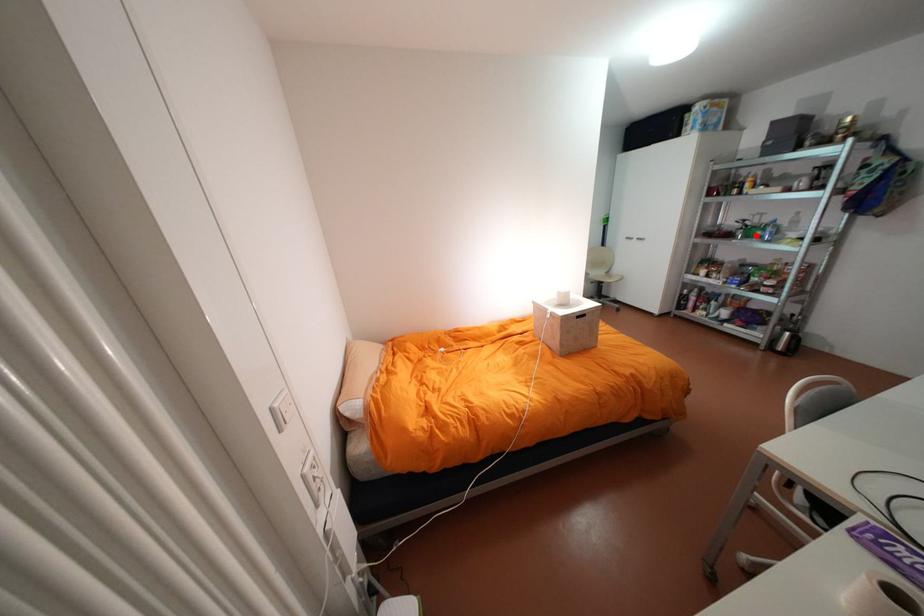
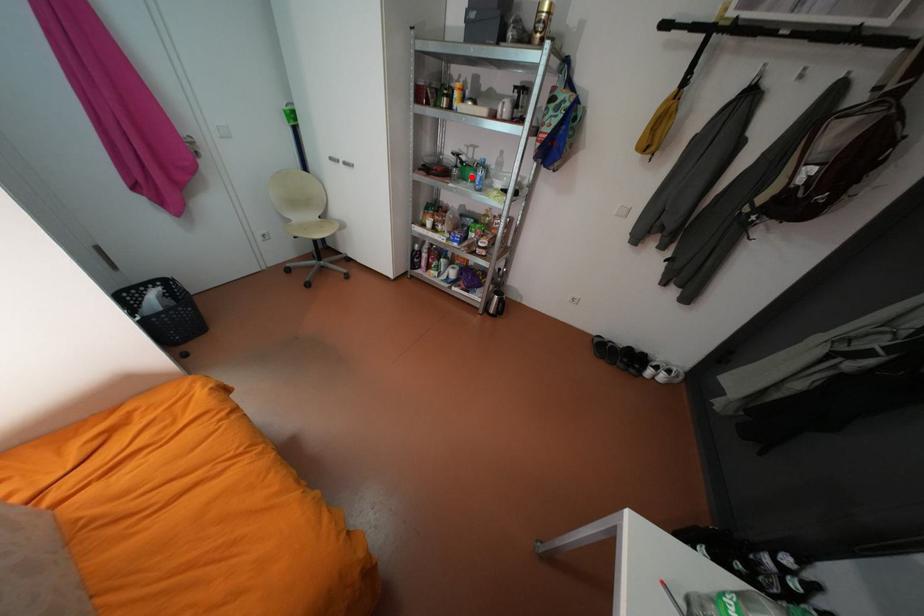
I am providing you with two images of the same scene from different viewpoints. A red point is marked on the first image and another point is marked on the second image. Do the highlighted points in image1 and image2 indicate the same real-world spot?

Yes